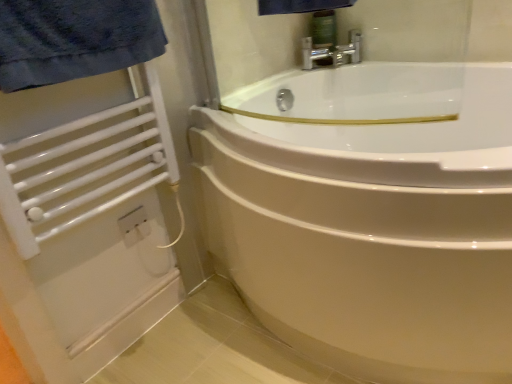
What do you see at coordinates (86, 166) in the screenshot?
I see `white metal towel rack at left` at bounding box center [86, 166].

Where is `white metal towel rack at left`? This screenshot has height=384, width=512. white metal towel rack at left is located at coordinates (86, 166).

In order to click on white glossy bathtub at center in this screenshot , I will do `click(372, 234)`.

This screenshot has height=384, width=512. What do you see at coordinates (372, 234) in the screenshot? I see `white glossy bathtub at center` at bounding box center [372, 234].

The width and height of the screenshot is (512, 384). Find the location of `white metal towel rack at left`. white metal towel rack at left is located at coordinates (86, 166).

Visually, is white glossy bathtub at center positioned to the left or to the right of white metal towel rack at left?

In the image, white glossy bathtub at center appears on the right side of white metal towel rack at left.

Relative to white metal towel rack at left, is white glossy bathtub at center in front or behind?

In the image, white glossy bathtub at center appears in front of white metal towel rack at left.

Is point (487, 343) farther from viewer compared to point (154, 153)?

No, (487, 343) is closer to viewer.

From the image's perspective, does white glossy bathtub at center appear lower than white metal towel rack at left?

Yes, from the image's perspective, white glossy bathtub at center is below white metal towel rack at left.

In the scene shown: From a real-world perspective, is white glossy bathtub at center below white metal towel rack at left?

Yes, from a real-world perspective, white glossy bathtub at center is under white metal towel rack at left.

Can you confirm if white glossy bathtub at center is thinner than white metal towel rack at left?

In fact, white glossy bathtub at center might be wider than white metal towel rack at left.

Is white glossy bathtub at center taller or shorter than white metal towel rack at left?

In the image, white glossy bathtub at center appears to be taller than white metal towel rack at left.

Can you confirm if white glossy bathtub at center is smaller than white metal towel rack at left?

No, white glossy bathtub at center is not smaller than white metal towel rack at left.

Is white glossy bathtub at center not inside white metal towel rack at left?

white glossy bathtub at center lies outside white metal towel rack at left's area.

Are white glossy bathtub at center and white metal towel rack at left far apart?

That's not correct — white glossy bathtub at center is a little close to white metal towel rack at left.

Could you tell me if white glossy bathtub at center is turned towards white metal towel rack at left?

No.

The height and width of the screenshot is (384, 512). I want to click on bathtub that appears in front of the white metal towel rack at left, so click(x=372, y=234).

Is white metal towel rack at left at the left side of white glossy bathtub at center?

Correct, you'll find white metal towel rack at left to the left of white glossy bathtub at center.

From the picture: Which object is further away from the camera taking this photo, white metal towel rack at left or white glossy bathtub at center?

white metal towel rack at left.

Based on the photo, which is less distant, (135, 144) or (355, 191)?

Clearly, point (135, 144) is more distant from the camera than point (355, 191).

From the image's perspective, relative to white glossy bathtub at center, is white metal towel rack at left above or below?

white metal towel rack at left is situated higher than white glossy bathtub at center in the image.

In the scene shown: From a real-world perspective, is white metal towel rack at left under white glossy bathtub at center?

No, from a real-world perspective, white metal towel rack at left is not below white glossy bathtub at center.

In the scene shown: Between white metal towel rack at left and white glossy bathtub at center, which one has smaller width?

white metal towel rack at left.

Considering the sizes of objects white metal towel rack at left and white glossy bathtub at center in the image provided, who is shorter, white metal towel rack at left or white glossy bathtub at center?

Standing shorter between the two is white metal towel rack at left.

Who is bigger, white metal towel rack at left or white glossy bathtub at center?

With larger size is white glossy bathtub at center.

Is white metal towel rack at left inside the boundaries of white glossy bathtub at center, or outside?

white metal towel rack at left is located beyond the bounds of white glossy bathtub at center.

Can you see white metal towel rack at left touching white glossy bathtub at center?

No, white metal towel rack at left is not with white glossy bathtub at center.

Is white metal towel rack at left positioned with its back to white glossy bathtub at center?

No, white metal towel rack at left is not facing away from white glossy bathtub at center.

In the image, there is a white glossy bathtub at center. At what (x,y) coordinates should I click in order to perform the action: click on balustrade above it (from the image's perspective). Please return your answer as a coordinate pair (x, y). The height and width of the screenshot is (384, 512). Looking at the image, I should click on (86, 166).

You are a GUI agent. You are given a task and a screenshot of the screen. Output one action in this format:
    pyautogui.click(x=<x>, y=<y>)
    Task: Click on the bathtub below the white metal towel rack at left (from a real-world perspective)
    This screenshot has height=384, width=512.
    Given the screenshot: What is the action you would take?
    pyautogui.click(x=372, y=234)

Find the location of a particular element. The height and width of the screenshot is (384, 512). bathtub lying below the white metal towel rack at left (from the image's perspective) is located at coordinates (372, 234).